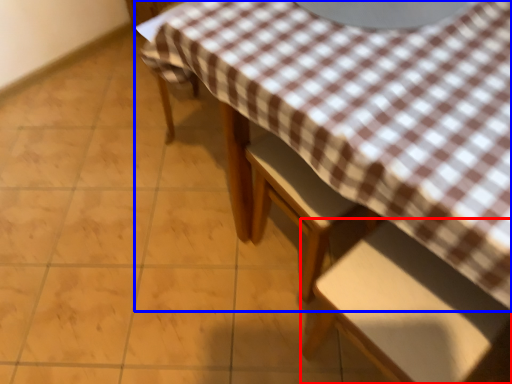
Question: Which point is closer to the camera, chair (highlighted by a red box) or table (highlighted by a blue box)?

Choices:
 (A) chair
 (B) table

Answer: (A)